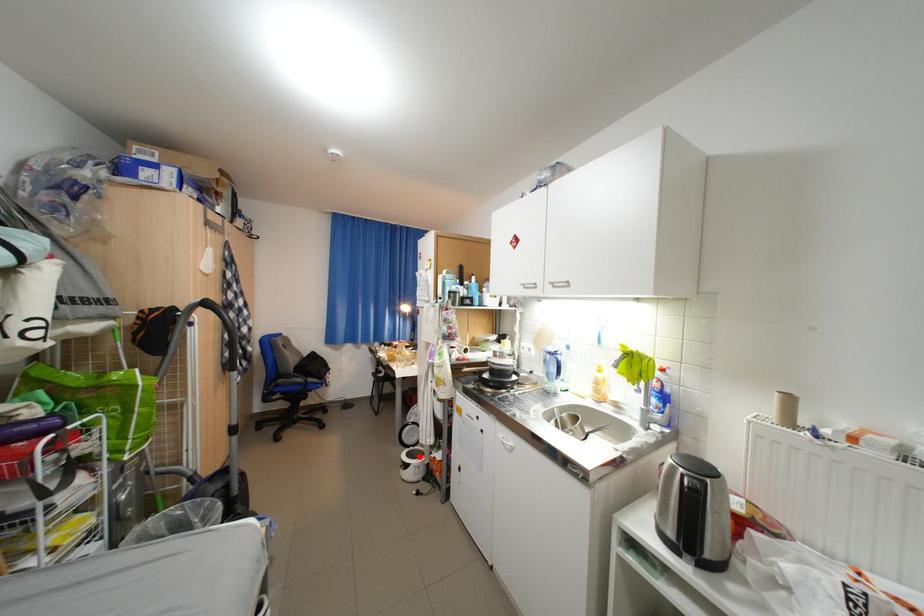
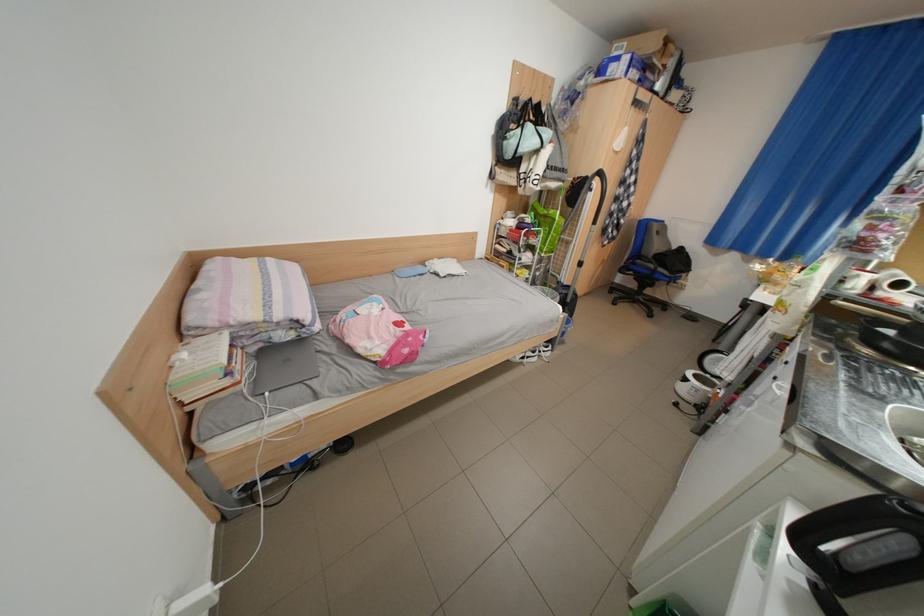
Where in the second image is the point corresponding to the highlighted location from the first image?

(708, 377)